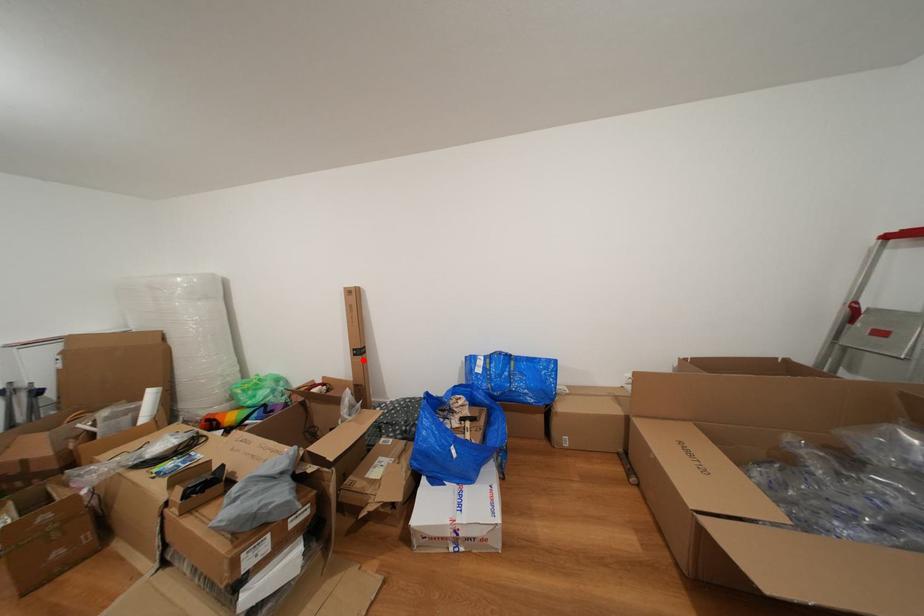
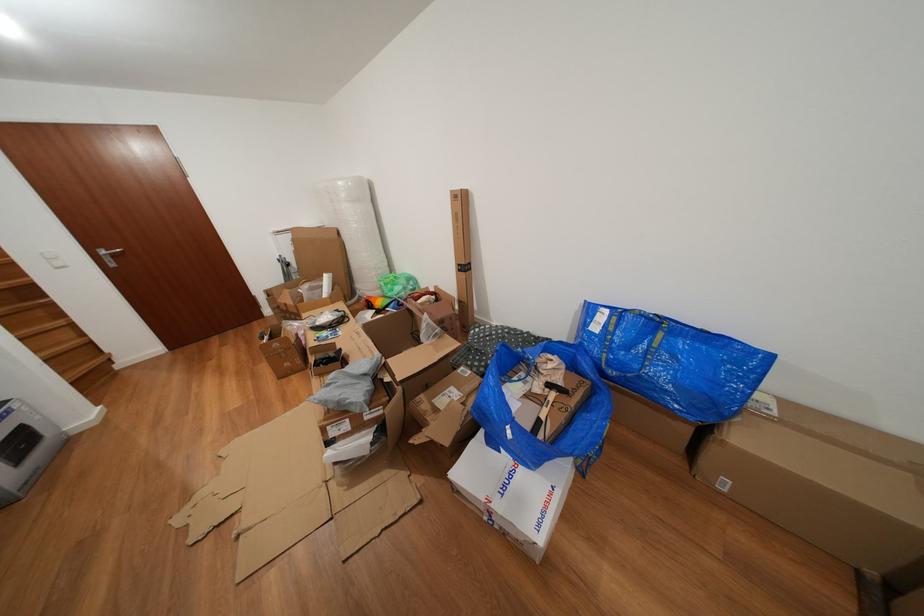
Where in the second image is the point corresponding to the highlighted location from the first image?

(468, 276)